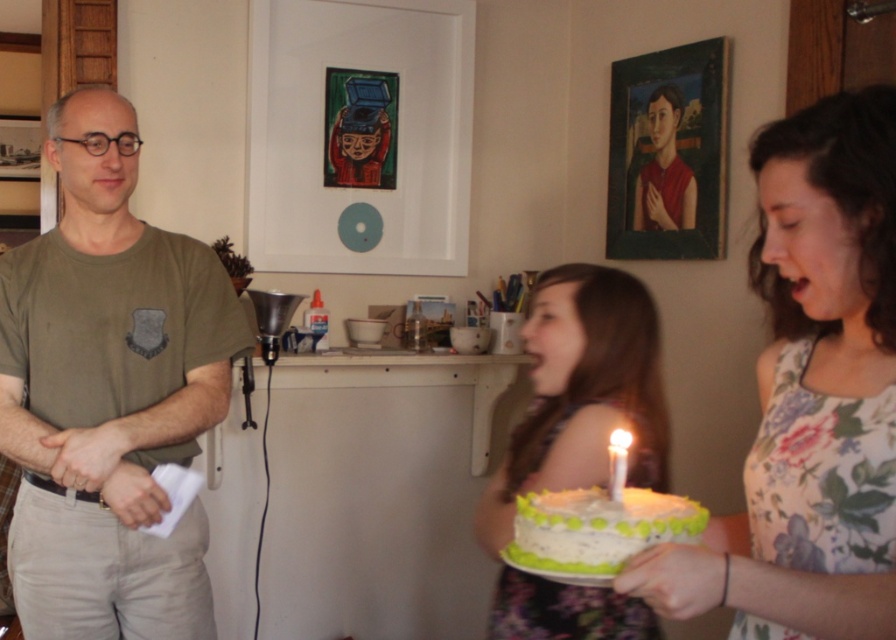
You are planning to place a decorative ribbon around the green frosted cake at center and the white wax candle at center. Which object requires a longer ribbon to fully encircle it?

The green frosted cake at center requires a longer ribbon to fully encircle it because it has a larger size compared to the white wax candle at center.

Looking at this image, you are standing in the kitchen and want to place a new picture frame between the two points labeled point (59,403) and point (631,304). Which point is closer to you so you can start placing the frame from there?

Point (59,403) is closer to you than point (631,304), so you should start placing the frame from point (59,403).

You are a photographer setting up for a group photo. You need to ensure that the matte black shirt at center and the white wax candle at center are both visible in the frame. Given their heights, which object will you need to adjust to avoid being blocked by the other?

The matte black shirt at center is taller than the white wax candle at center. To ensure both are visible, you should lower the matte black shirt at center or raise the white wax candle at center so they don not block each other.